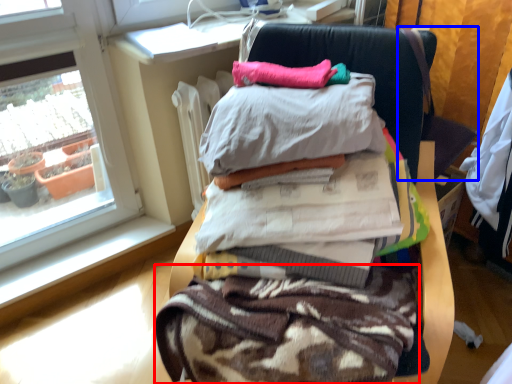
Question: Which point is closer to the camera, fabric (highlighted by a red box) or computer chair (highlighted by a blue box)?

Choices:
 (A) fabric
 (B) computer chair

Answer: (A)